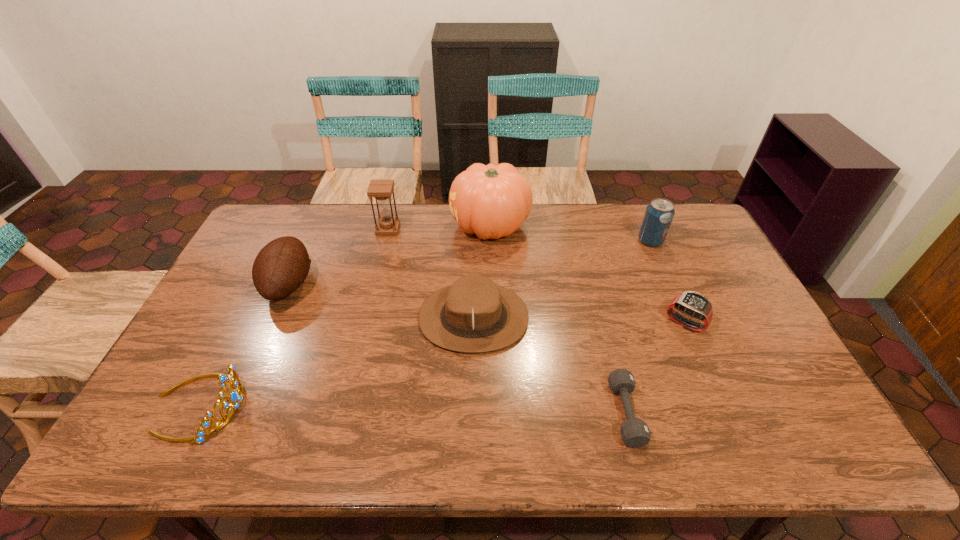
I want to click on the tallest object, so click(x=492, y=201).

Locate an element on the screen. The width and height of the screenshot is (960, 540). the third object from left to right is located at coordinates click(x=381, y=190).

Image resolution: width=960 pixels, height=540 pixels. Identify the location of pop soda. (659, 214).

This screenshot has height=540, width=960. What are the coordinates of `football` in the screenshot? It's located at pos(282,265).

Identify the location of fedora. (473, 315).

Identify the location of tiara. The height and width of the screenshot is (540, 960). (235, 396).

The height and width of the screenshot is (540, 960). I want to click on the second shortest object, so click(x=693, y=304).

I want to click on the shortest object, so click(635, 433).

In order to click on dumbbell in this screenshot , I will do `click(635, 433)`.

Locate an element on the screen. free space located on the carved face of the pumpkin is located at coordinates (346, 226).